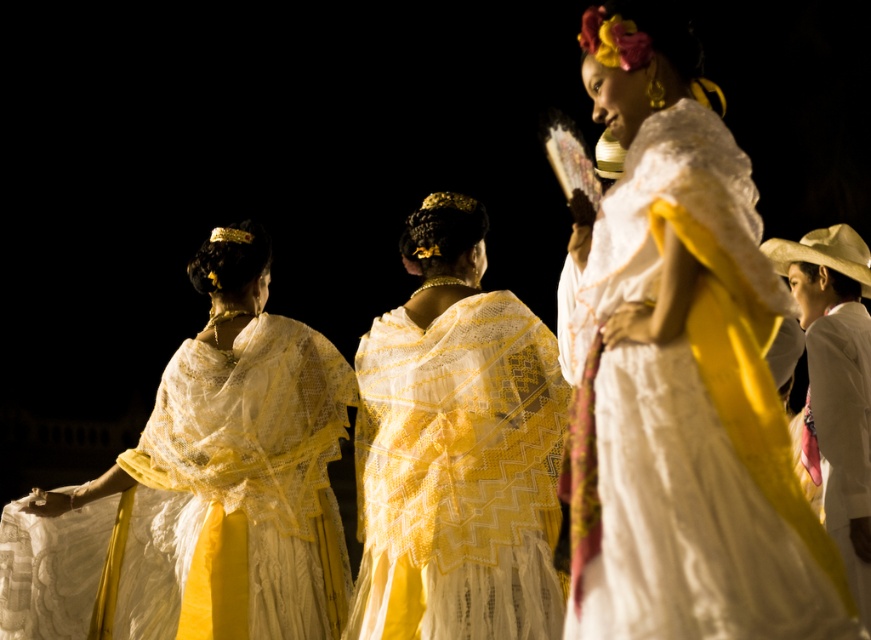
Question: Is matte white lace shawl at upper left to the left of white lace dress at center from the viewer's perspective?

Choices:
 (A) yes
 (B) no

Answer: (A)

Question: In this image, where is matte white dress at center located relative to white satin robe at right?

Choices:
 (A) right
 (B) left

Answer: (B)

Question: Among these points, which one is farthest from the camera?

Choices:
 (A) (x=847, y=548)
 (B) (x=426, y=627)
 (C) (x=233, y=230)

Answer: (A)

Question: Among these points, which one is nearest to the camera?

Choices:
 (A) (440, 312)
 (B) (269, 531)

Answer: (A)

Question: Considering the real-world distances, which object is farthest from the white satin robe at right?

Choices:
 (A) white lace dress at center
 (B) matte white dress at center

Answer: (A)

Question: Does matte white dress at center appear on the left side of white lace dress at center?

Choices:
 (A) yes
 (B) no

Answer: (B)